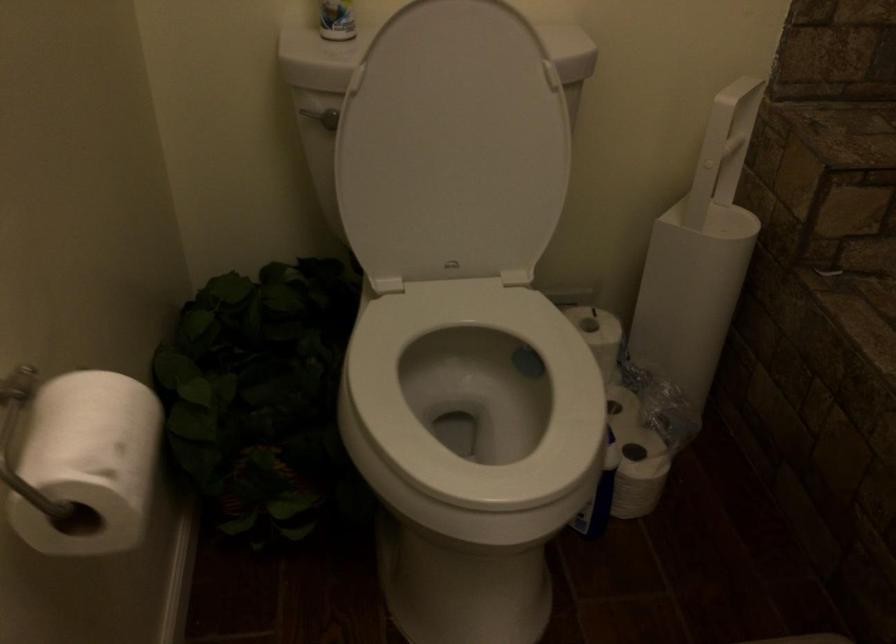
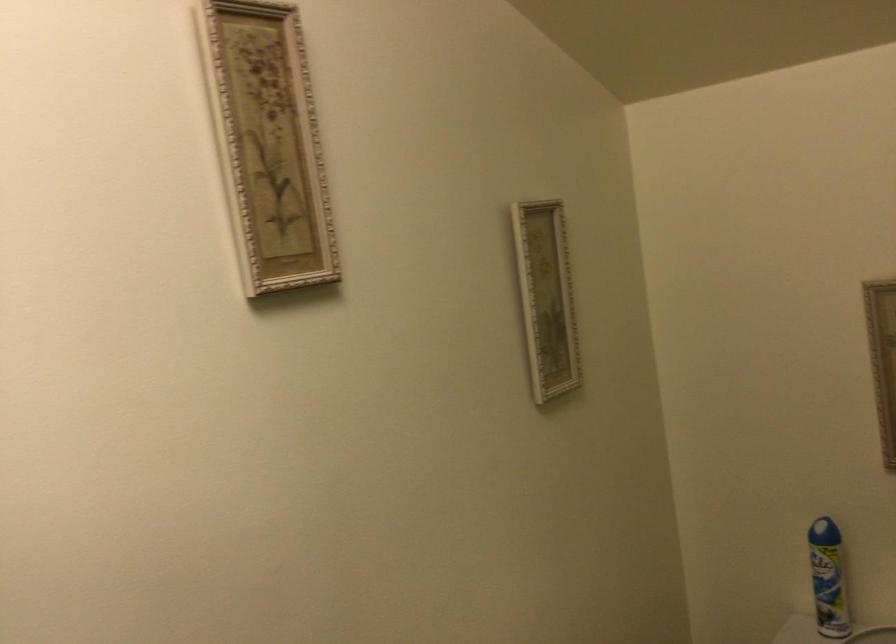
The first image is from the beginning of the video and the second image is from the end. How did the camera likely rotate when shooting the video?

The rotation direction of the camera is left-up.